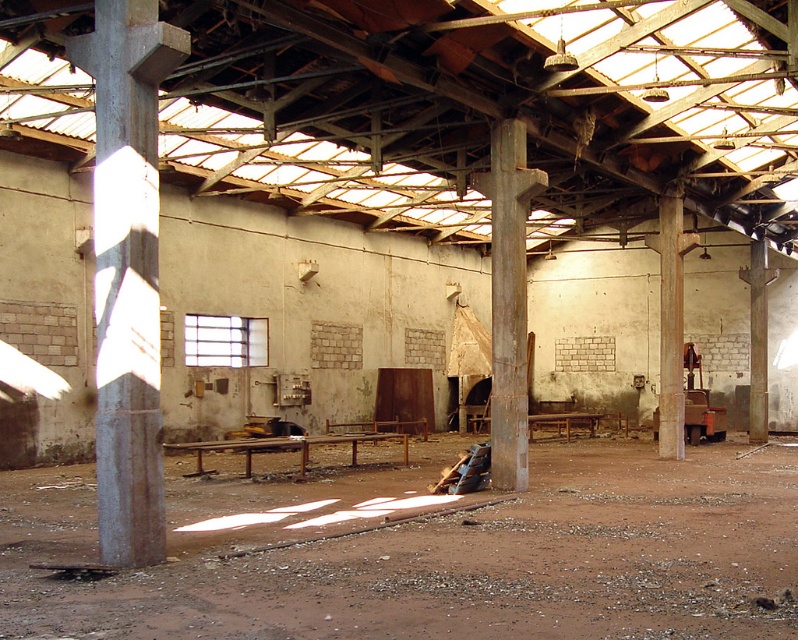
Can you confirm if concrete at left is smaller than rusty metal pillar at center?

Yes, concrete at left is smaller than rusty metal pillar at center.

Does point (115, 467) come behind point (492, 360)?

No.

Identify the location of concrete at left. Image resolution: width=798 pixels, height=640 pixels. (127, 269).

Is rusty metal pillar at center thinner than smooth concrete pillar at right?

Correct, rusty metal pillar at center's width is less than smooth concrete pillar at right's.

Which is below, rusty metal pillar at center or smooth concrete pillar at right?

Positioned lower is rusty metal pillar at center.

Is point (512, 394) more distant than point (676, 330)?

No, (512, 394) is closer to viewer.

This screenshot has height=640, width=798. Identify the location of rusty metal pillar at center. (508, 298).

Between concrete at left and smooth concrete pillar at right, which one appears on the right side from the viewer's perspective?

From the viewer's perspective, smooth concrete pillar at right appears more on the right side.

Who is more distant from viewer, (105, 163) or (664, 230)?

Positioned behind is point (664, 230).

This screenshot has height=640, width=798. Identify the location of concrete at left. (127, 269).